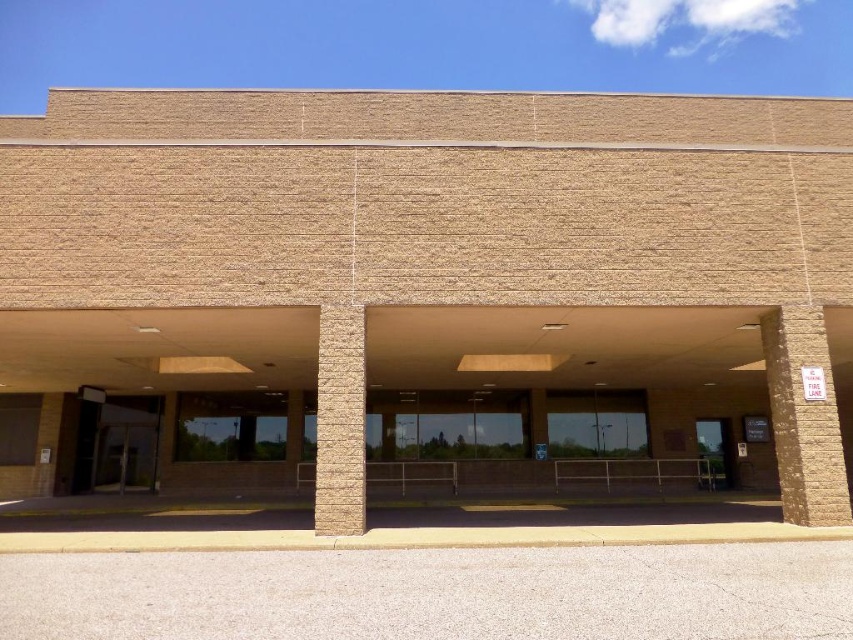
Is brown brick pillar at right taller than beige textured pillar at center?

Indeed, brown brick pillar at right has a greater height compared to beige textured pillar at center.

Is point (811, 403) closer to viewer compared to point (347, 472)?

That is False.

Where is `brown brick pillar at right`? brown brick pillar at right is located at coordinates click(x=804, y=417).

Is brown brick pillar at right thinner than brown brick pillar at left?

No.

Who is higher up, brown brick pillar at right or brown brick pillar at left?

brown brick pillar at right is above.

Which is in front, point (795, 502) or point (61, 410)?

Point (795, 502) is more forward.

Identify the location of brown brick pillar at right. This screenshot has width=853, height=640. (804, 417).

Does beige textured pillar at center appear over brown brick pillar at left?

Yes.

Which is above, beige textured pillar at center or brown brick pillar at left?

beige textured pillar at center

Where is `beige textured pillar at center`? The image size is (853, 640). beige textured pillar at center is located at coordinates (340, 420).

Identify the location of beige textured pillar at center. The height and width of the screenshot is (640, 853). (340, 420).